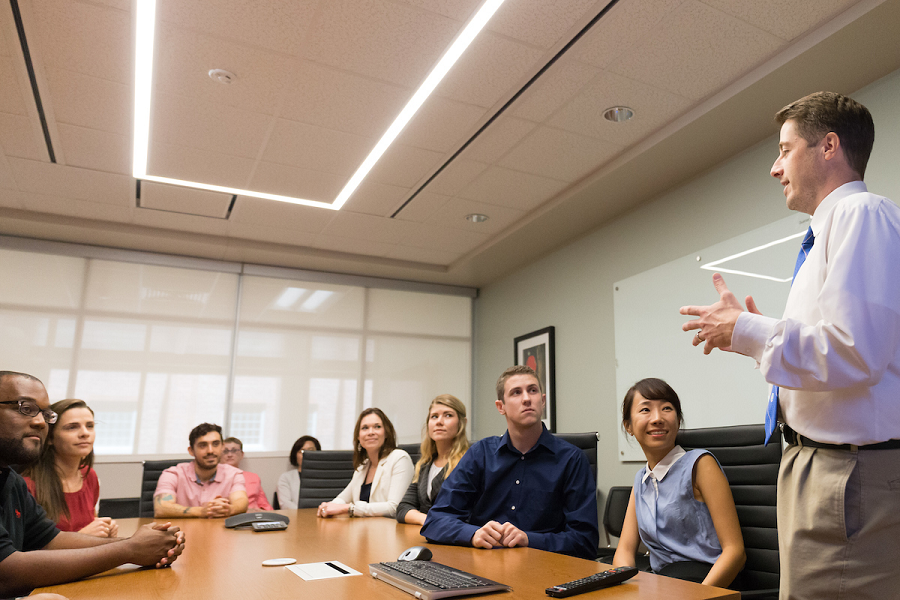
What are the coordinates of `lights` in the screenshot? It's located at (478, 219), (621, 108), (140, 81), (279, 198), (396, 120), (321, 297), (293, 300).